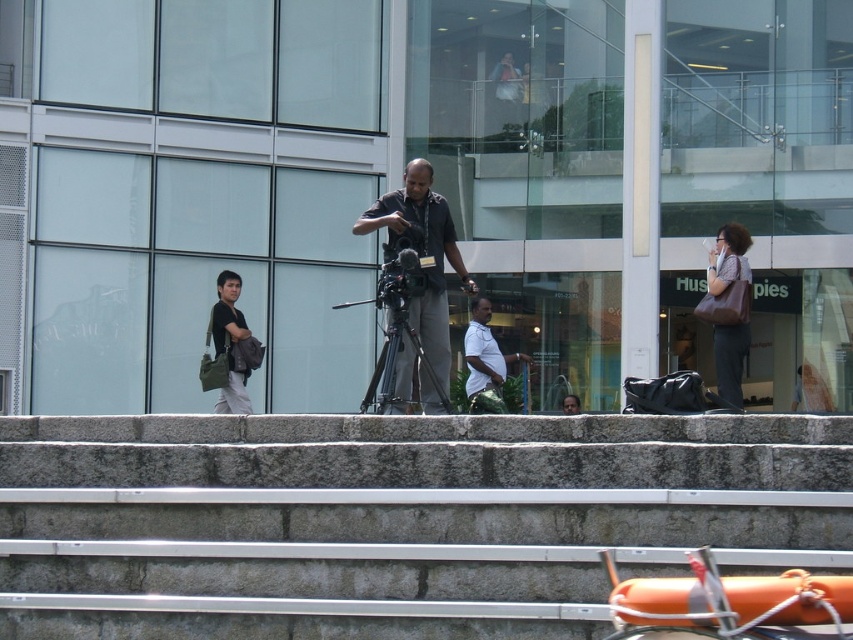
You are standing at the base of the stone steps leading to the modern glass building. You want to place a small potted plant exactly at the point marked by the coordinates point (415,356). Since this point is on the black matte tripod at center, will placing the plant there block the tripod?

The point (415,356) is on the black matte tripod at center, so placing the plant there would block the tripod.

You are a passerby who wants to take a photo of the modern glass building without any obstructions. The black matte tripod at center and metallic silver video camera at center are in your way. Which object should you move to clear the path?

You should move the black matte tripod at center because it is positioned on the right side of the metallic silver video camera at center, so moving it would clear the path.

You are a passerby who wants to take a photo of the modern glass building without any obstructions. The black matte tripod at center and the metallic silver video camera at center are in your way. Which object should you move to get a clear view?

You should move the black matte tripod at center because it is closer to the viewer than the metallic silver video camera at center, so removing it would clear the path.